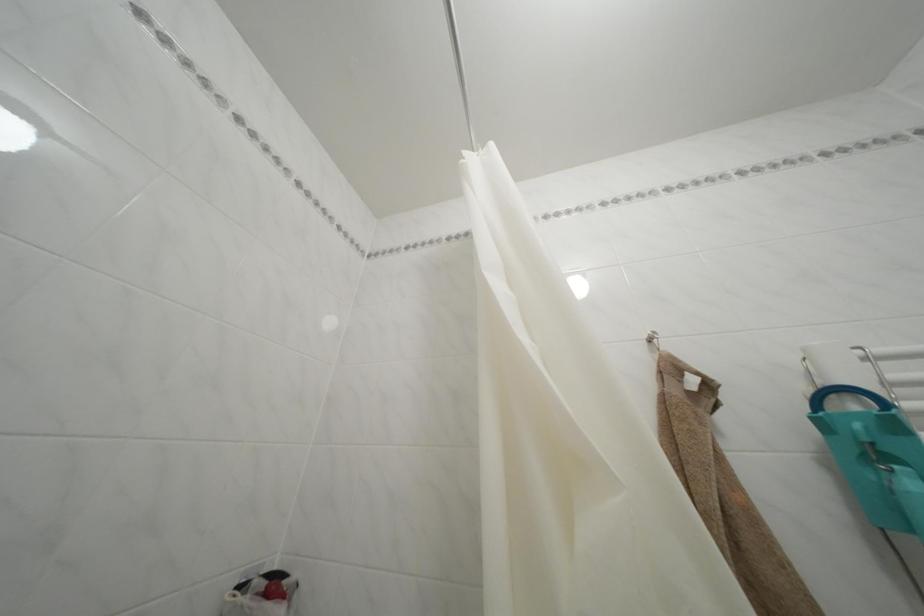
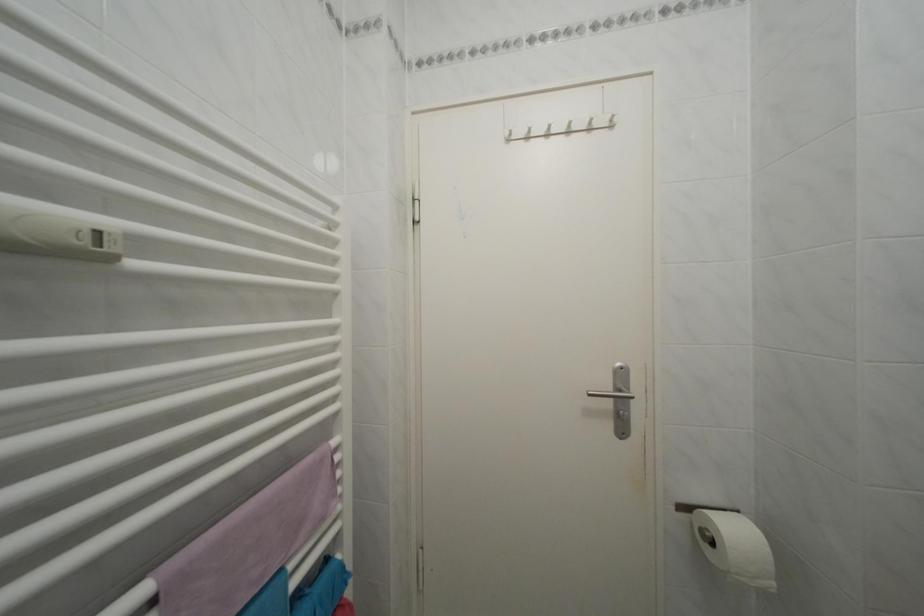
Question: The first image is from the beginning of the video and the second image is from the end. How did the camera likely rotate when shooting the video?

Choices:
 (A) Left
 (B) Right
 (C) Up
 (D) Down

Answer: (B)